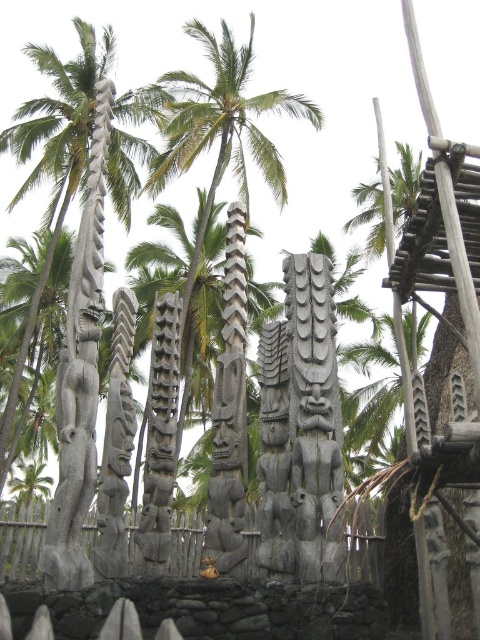
Between dark gray wooden fence at center and dark gray wood totem pole at center, which one has less height?

dark gray wood totem pole at center is shorter.

What do you see at coordinates (22, 538) in the screenshot?
I see `dark gray wooden fence at center` at bounding box center [22, 538].

Between point (134, 541) and point (173, 301), which one is positioned behind?

Positioned behind is point (173, 301).

This screenshot has height=640, width=480. What are the coordinates of `dark gray wooden fence at center` in the screenshot? It's located at (22, 538).

Is point (276, 499) in front of point (170, 502)?

Yes, point (276, 499) is closer to viewer.

Between gray stone totem pole at center and dark gray wood totem pole at center, which one is positioned higher?

gray stone totem pole at center

The width and height of the screenshot is (480, 640). I want to click on gray stone totem pole at center, so click(300, 429).

Locate an element on the screen. This screenshot has height=640, width=480. gray stone totem pole at center is located at coordinates (300, 429).

Is dark gray wood totem pole at center behind dark gray stone totem pole at center?

Yes, it is.

Image resolution: width=480 pixels, height=640 pixels. Describe the element at coordinates (159, 435) in the screenshot. I see `dark gray wood totem pole at center` at that location.

Locate an element on the screen. The height and width of the screenshot is (640, 480). dark gray wood totem pole at center is located at coordinates (159, 435).